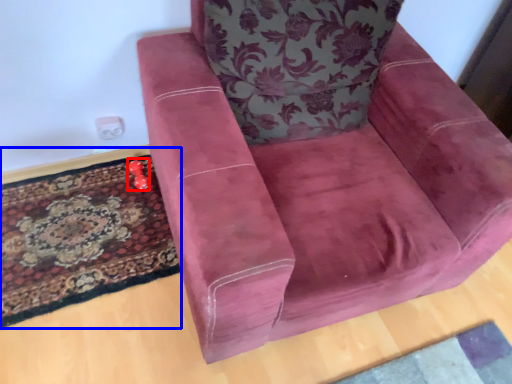
Question: Which point is further to the camera, toy (highlighted by a red box) or mat (highlighted by a blue box)?

Choices:
 (A) toy
 (B) mat

Answer: (A)